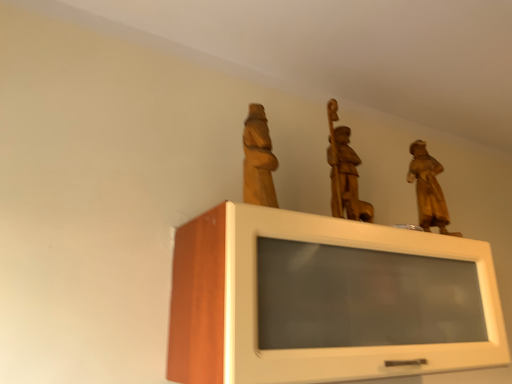
Question: Is wooden statue at center, which is the 2th sculpture in left-to-right order, at the left side of white glossy cabinet at upper center?

Choices:
 (A) yes
 (B) no

Answer: (B)

Question: Is wooden statue at center, which is the 2th sculpture in left-to-right order, outside white glossy cabinet at upper center?

Choices:
 (A) no
 (B) yes

Answer: (B)

Question: Does wooden statue at center, which is the 2th sculpture in left-to-right order, have a lesser height compared to white glossy cabinet at upper center?

Choices:
 (A) yes
 (B) no

Answer: (A)

Question: Considering the relative sizes of wooden statue at center, arranged as the 2th sculpture when viewed from the right, and white glossy cabinet at upper center in the image provided, is wooden statue at center, arranged as the 2th sculpture when viewed from the right, thinner than white glossy cabinet at upper center?

Choices:
 (A) yes
 (B) no

Answer: (A)

Question: Considering the relative sizes of wooden statue at center, arranged as the 2th sculpture when viewed from the right, and white glossy cabinet at upper center in the image provided, is wooden statue at center, arranged as the 2th sculpture when viewed from the right, smaller than white glossy cabinet at upper center?

Choices:
 (A) yes
 (B) no

Answer: (A)

Question: Looking at the image, does wooden statue at upper center, placed as the 1th sculpture when sorted from left to right, seem bigger or smaller compared to wooden statue at upper right, the third sculpture positioned from the left?

Choices:
 (A) big
 (B) small

Answer: (B)

Question: In terms of height, does wooden statue at upper center, placed as the 1th sculpture when sorted from left to right, look taller or shorter compared to wooden statue at upper right, arranged as the first sculpture when viewed from the right?

Choices:
 (A) short
 (B) tall

Answer: (A)

Question: Considering the relative positions of wooden statue at upper center, placed as the 1th sculpture when sorted from left to right, and wooden statue at upper right, arranged as the first sculpture when viewed from the right, in the image provided, is wooden statue at upper center, placed as the 1th sculpture when sorted from left to right, to the left or to the right of wooden statue at upper right, arranged as the first sculpture when viewed from the right,?

Choices:
 (A) right
 (B) left

Answer: (B)

Question: From a real-world perspective, relative to wooden statue at upper right, the third sculpture positioned from the left, is wooden statue at upper center, the 3th sculpture in the right-to-left sequence, vertically above or below?

Choices:
 (A) below
 (B) above

Answer: (B)

Question: Is wooden statue at upper right, the third sculpture positioned from the left, taller or shorter than white glossy cabinet at upper center?

Choices:
 (A) short
 (B) tall

Answer: (A)

Question: Is wooden statue at upper right, the third sculpture positioned from the left, inside the boundaries of white glossy cabinet at upper center, or outside?

Choices:
 (A) outside
 (B) inside

Answer: (A)

Question: From the image's perspective, is wooden statue at upper right, the third sculpture positioned from the left, above or below white glossy cabinet at upper center?

Choices:
 (A) above
 (B) below

Answer: (A)

Question: Does point (425, 188) appear closer or farther from the camera than point (201, 309)?

Choices:
 (A) closer
 (B) farther

Answer: (B)

Question: From a real-world perspective, is wooden statue at center, arranged as the 2th sculpture when viewed from the right, physically located above or below wooden statue at upper right, the third sculpture positioned from the left?

Choices:
 (A) below
 (B) above

Answer: (B)

Question: Considering the positions of wooden statue at center, arranged as the 2th sculpture when viewed from the right, and wooden statue at upper right, the third sculpture positioned from the left, in the image, is wooden statue at center, arranged as the 2th sculpture when viewed from the right, taller or shorter than wooden statue at upper right, the third sculpture positioned from the left,?

Choices:
 (A) short
 (B) tall

Answer: (B)